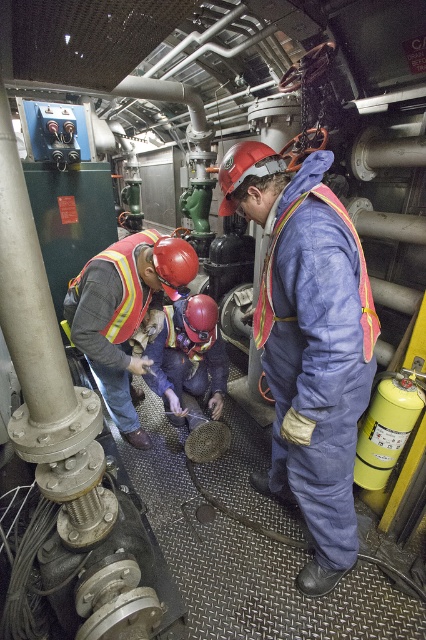
Question: Which point appears closest to the camera in this image?

Choices:
 (A) (134, 237)
 (B) (287, 301)
 (C) (124, 312)

Answer: (B)

Question: Which is nearer to the blue coveralls at center?

Choices:
 (A) reflective orange safety vest at center
 (B) reflective yellow safety vest at lower left

Answer: (A)

Question: Is blue coveralls at center thinner than reflective yellow safety vest at lower left?

Choices:
 (A) yes
 (B) no

Answer: (B)

Question: Which point is farther to the camera?

Choices:
 (A) reflective yellow safety vest at lower left
 (B) blue coveralls at center
 (C) reflective orange safety vest at center

Answer: (A)

Question: Does blue coveralls at center lie in front of reflective yellow safety vest at lower left?

Choices:
 (A) yes
 (B) no

Answer: (A)

Question: Does blue coveralls at center have a greater width compared to reflective yellow safety vest at lower left?

Choices:
 (A) no
 (B) yes

Answer: (B)